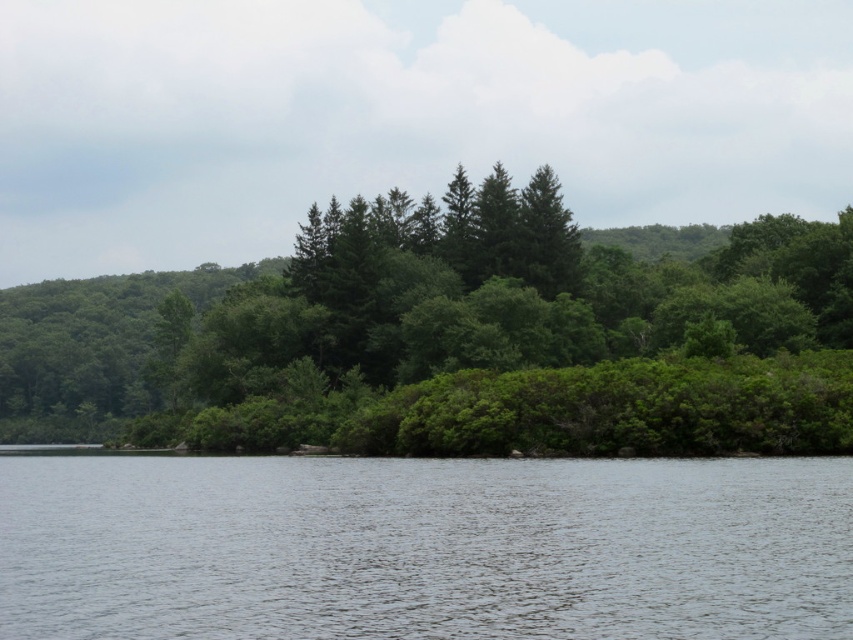
Question: Is green leafy trees at center to the right of clear water at center from the viewer's perspective?

Choices:
 (A) no
 (B) yes

Answer: (A)

Question: Can you confirm if green leafy trees at center is positioned to the left of clear water at center?

Choices:
 (A) yes
 (B) no

Answer: (A)

Question: Does green leafy trees at center appear over clear water at center?

Choices:
 (A) no
 (B) yes

Answer: (B)

Question: Which of the following is the closest to the observer?

Choices:
 (A) (746, 368)
 (B) (329, 580)

Answer: (B)